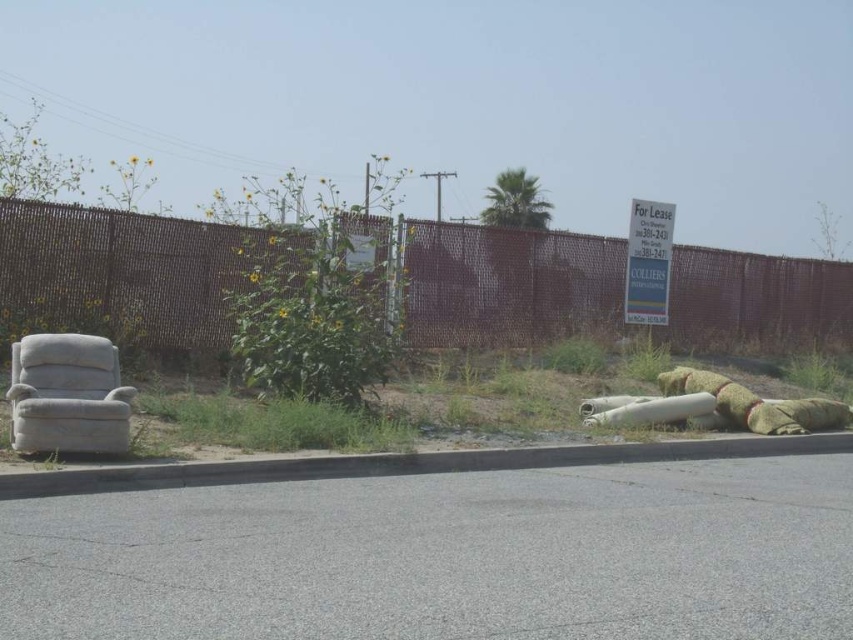
You are a delivery person trying to park your van in the area near the gray asphalt curb at lower left and the white fabric armchair at left. Based on the scene, can you determine which object is closer to the curb?

The gray asphalt curb at lower left is positioned on the right side of white fabric armchair at left, meaning the white fabric armchair at left is closer to the curb than the curb itself. Therefore, the white fabric armchair at left is closer to the curb.

You are a delivery person trying to park your 6.5 meter long truck in the space between the brown mesh fence at center and the gray asphalt curb at lower left. Based on the scene description, can your truck fit in that space?

The distance between the brown mesh fence at center and the gray asphalt curb at lower left is 7.27 meters. Since your truck is 6.5 meters long, it can fit in the space as there is enough length available.

You are a delivery person trying to place a package on the brown mesh fence at center. However, you notice the white fabric armchair at left is in the way. Can you place the package on the fence without moving the chair?

The brown mesh fence at center is located above the white fabric armchair at left, so you can place the package on the fence without moving the chair since the fence is elevated and not blocked by the chair.